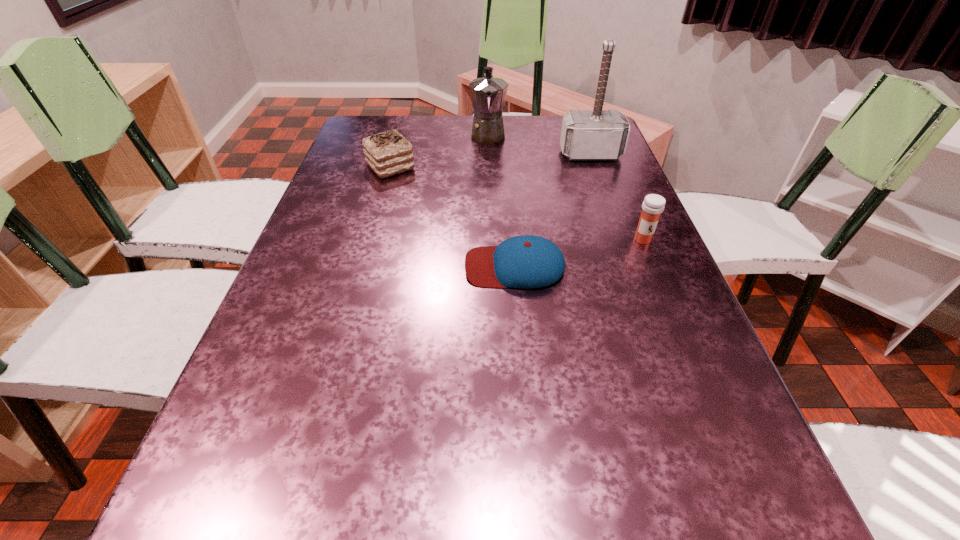
Identify the location of free region at the right edge. (709, 395).

Where is `free space at the far left corner of the desktop`? This screenshot has height=540, width=960. free space at the far left corner of the desktop is located at coordinates (359, 148).

Find the location of a particular element. This screenshot has height=540, width=960. vacant space at the near right corner of the desktop is located at coordinates (674, 527).

You are a GUI agent. You are given a task and a screenshot of the screen. Output one action in this format:
    pyautogui.click(x=<x>, y=<y>)
    Task: Click on the vacant space that is in between the leftmost object and the shortest object
    Image resolution: width=960 pixels, height=540 pixels.
    Given the screenshot: What is the action you would take?
    pyautogui.click(x=452, y=217)

At what (x,y) coordinates should I click in order to perform the action: click on free area in between the baseball cap and the chocolate cake. Please return your answer as a coordinate pair (x, y). The height and width of the screenshot is (540, 960). Looking at the image, I should click on (452, 217).

Identify the location of free space between the medicine and the tallest object. (616, 197).

Locate an element on the screen. The width and height of the screenshot is (960, 540). empty location between the coffeepot and the tallest object is located at coordinates (540, 144).

I want to click on free area in between the medicine and the shortest object, so click(579, 253).

Locate an element on the screen. vacant space that's between the leftmost object and the tallest object is located at coordinates (491, 161).

Where is `vacant point located between the baseball cap and the chocolate cake`? This screenshot has height=540, width=960. vacant point located between the baseball cap and the chocolate cake is located at coordinates (452, 217).